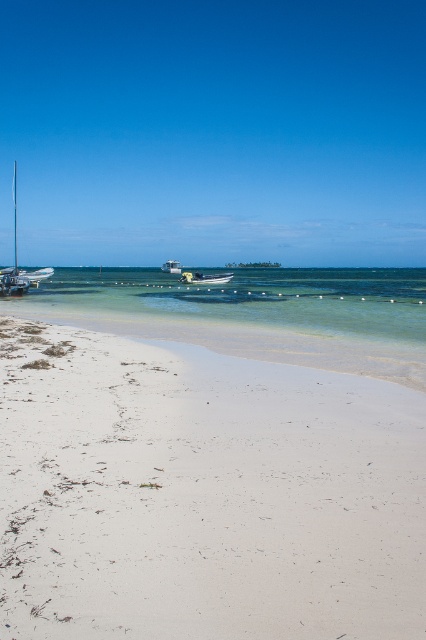
Question: Estimate the real-world distances between objects in this image. Which object is closer to the white sandy beach at lower left?

Choices:
 (A) white plastic boat at left
 (B) white plastic boat at center

Answer: (A)

Question: Does white plastic boat at center appear on the left side of white matte boat at center?

Choices:
 (A) no
 (B) yes

Answer: (A)

Question: Does shiny silver sailboat at left appear under white plastic boat at left?

Choices:
 (A) no
 (B) yes

Answer: (A)

Question: Which of the following is the closest to the observer?

Choices:
 (A) (39, 275)
 (B) (3, 273)

Answer: (B)

Question: Among these objects, which one is nearest to the camera?

Choices:
 (A) white sandy beach at lower left
 (B) white plastic boat at left
 (C) shiny silver sailboat at left

Answer: (A)

Question: Is shiny silver sailboat at left smaller than white plastic boat at left?

Choices:
 (A) yes
 (B) no

Answer: (B)